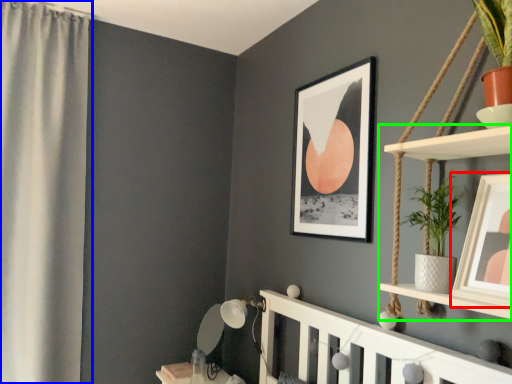
Question: Estimate the real-world distances between objects in this image. Which object is farther from picture frame (highlighted by a red box), curtain (highlighted by a blue box) or shelf (highlighted by a green box)?

Choices:
 (A) curtain
 (B) shelf

Answer: (A)